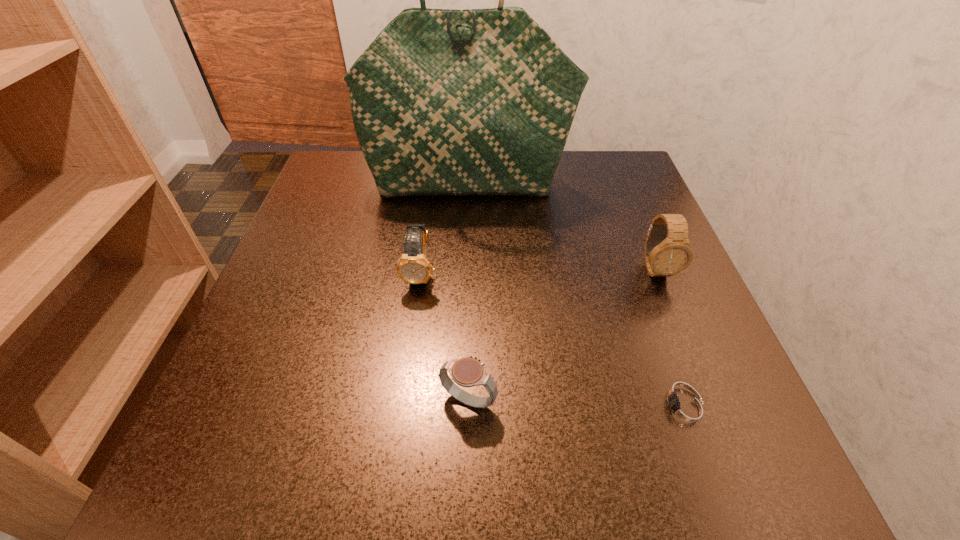
The height and width of the screenshot is (540, 960). In order to click on vacant space located on the face of the third shortest object in this screenshot , I will do `click(399, 431)`.

Locate an element on the screen. The height and width of the screenshot is (540, 960). vacant space situated 0.070m on the front of the second shortest watch is located at coordinates [x=468, y=469].

The height and width of the screenshot is (540, 960). Identify the location of vacant space situated on the face of the shortest object. (459, 408).

Where is `free space located 0.270m on the face of the shortest object`? The image size is (960, 540). free space located 0.270m on the face of the shortest object is located at coordinates (451, 408).

The image size is (960, 540). Identify the location of vacant space located 0.060m on the face of the shortest object. (604, 408).

This screenshot has height=540, width=960. I want to click on object located in the far edge section of the desktop, so click(444, 102).

Find the location of `object located at the near edge`. object located at the near edge is located at coordinates (684, 409).

Where is `object at the left edge`? object at the left edge is located at coordinates (444, 102).

You are a GUI agent. You are given a task and a screenshot of the screen. Output one action in this format:
    pyautogui.click(x=<x>, y=<y>)
    Task: Click on the tote bag at the right edge
    The width and height of the screenshot is (960, 540).
    Given the screenshot: What is the action you would take?
    pyautogui.click(x=444, y=102)

Where is `object that is at the far left corner`? object that is at the far left corner is located at coordinates (444, 102).